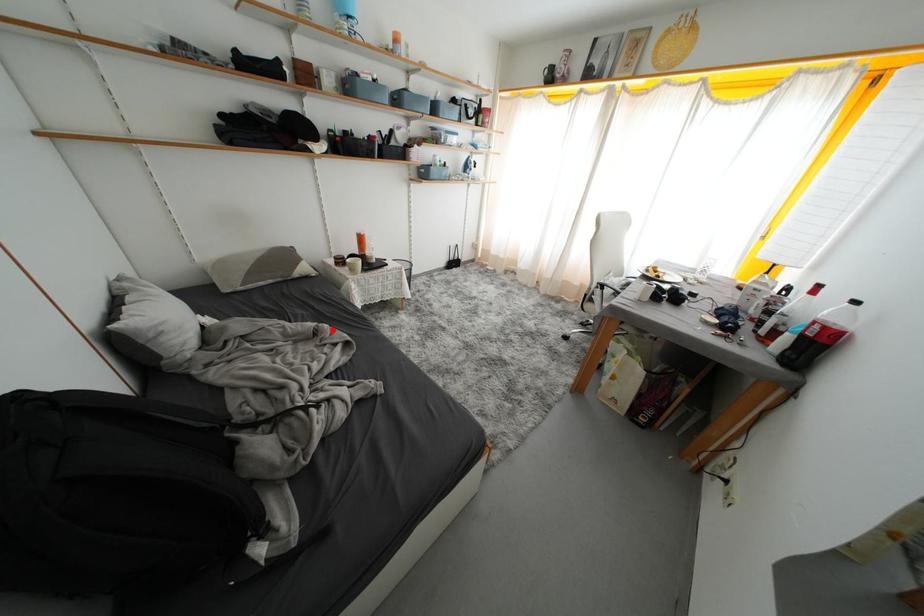
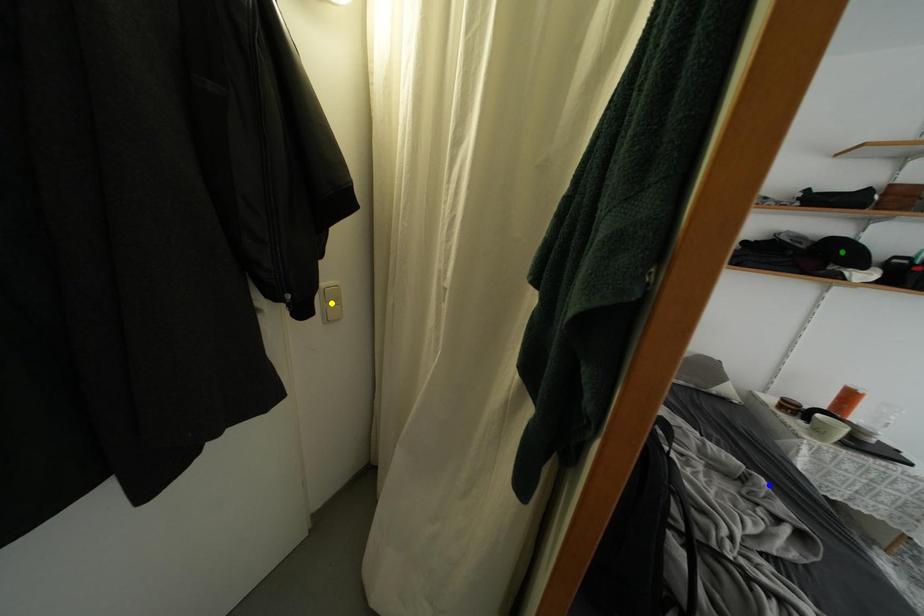
Question: I am providing you with two images of the same scene from different viewpoints. A red point is marked on the first image. You are given multiple points on the second image. In image 2, which mark is for the same physical point as the one in image 1?

Choices:
 (A) blue point
 (B) yellow point
 (C) green point

Answer: (A)